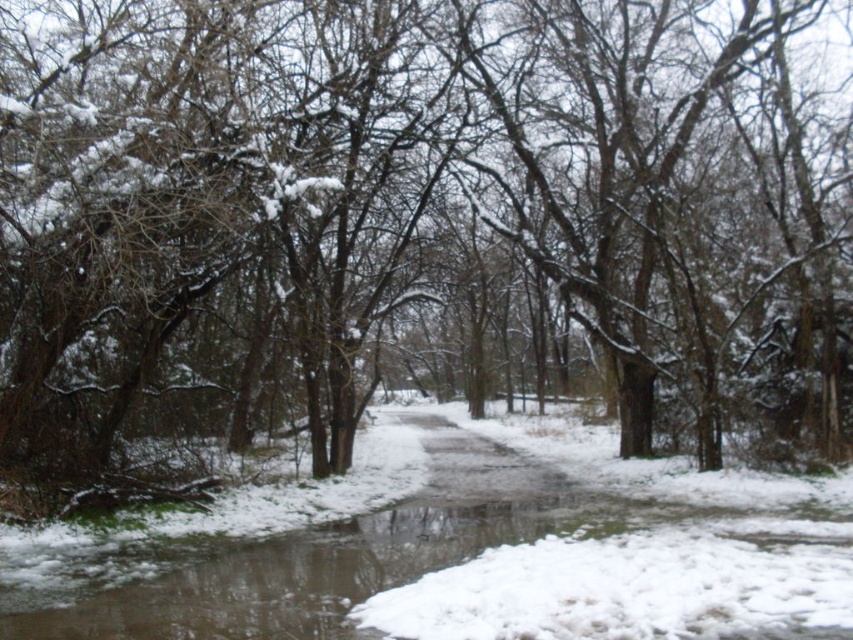
Is point (59, 595) closer to camera compared to point (514, 472)?

Yes, it is in front of point (514, 472).

Does point (683, 573) come closer to viewer compared to point (436, 465)?

Yes, point (683, 573) is in front of point (436, 465).

This screenshot has width=853, height=640. Identify the location of frozen water at center. (483, 556).